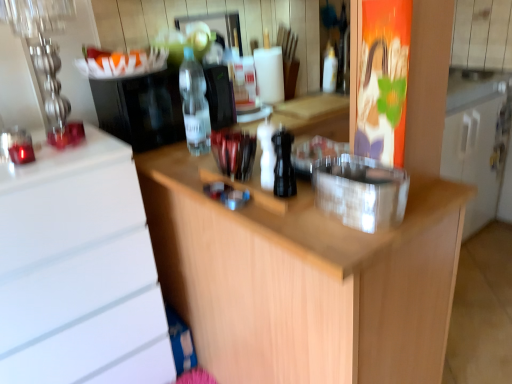
Question: In the image, is wooden at center positioned in front of or behind white glossy cabinet at left?

Choices:
 (A) behind
 (B) front

Answer: (B)

Question: From the image's perspective, relative to white glossy cabinet at left, is wooden at center above or below?

Choices:
 (A) below
 (B) above

Answer: (B)

Question: Which object is positioned closest to the transparent plastic bottle at upper center, arranged as the third bottle when viewed from the front?

Choices:
 (A) transparent plastic bottle at center, which is the second bottle from front to back
 (B) black matte pepper grinder at center, which ranks as the 2th bottle in left-to-right order
 (C) white glossy cabinet at left
 (D) black plastic coffee machine at center, placed as the 1th appliance when sorted from left to right
 (E) transparent plastic container at center, which is the second appliance in back-to-front order

Answer: (A)

Question: Considering the real-world distances, which object is closest to the transparent plastic bottle at upper center, which is the 1th bottle in top-to-bottom order?

Choices:
 (A) white glossy cabinet at left
 (B) transparent plastic bottle at center, positioned as the third bottle in right-to-left order
 (C) wooden at center
 (D) black matte pepper grinder at center, the 1th bottle positioned from the front
 (E) transparent plastic container at center, which is counted as the 1th appliance, starting from the front

Answer: (B)